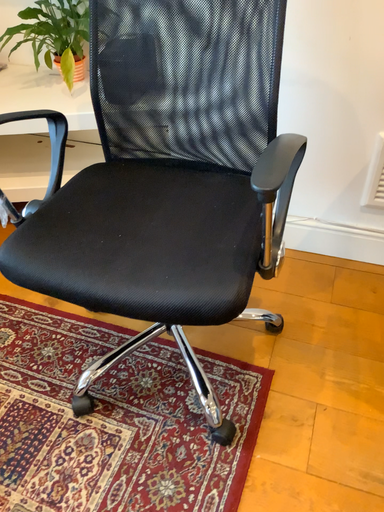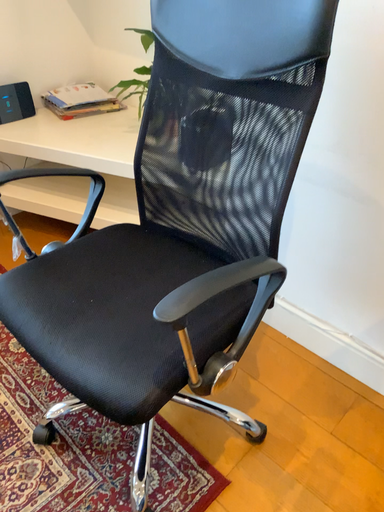
Question: How did the camera likely rotate when shooting the video?

Choices:
 (A) rotated downward
 (B) rotated upward

Answer: (B)